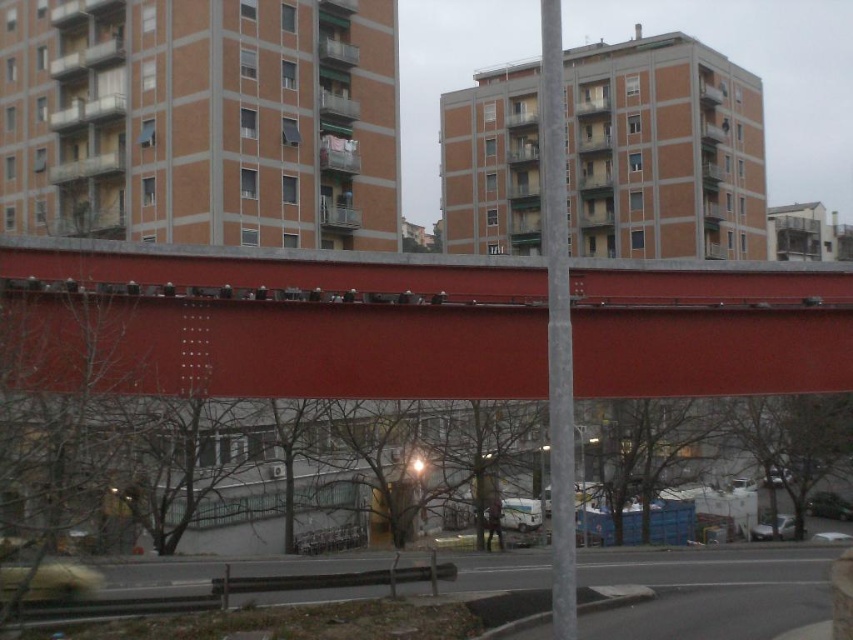
You are standing at the point with coordinates 0.5, 0.35 in the image. Is there a smooth red bridge at center near you?

Yes, the smooth red bridge at center is located at point [297,317], which is very close to your current position at [298,320].

You are standing at the point marked as point (556,323) in the image. What object is exactly at your current location?

The gray concrete pole at center is located at point (556,323).

You are a city planner assessing the space between the smooth red bridge at center and the gray concrete pole at center. If you want to install a new utility box that requires 2 meters of clearance, can the space accommodate it?

The smooth red bridge at center is thinner than the gray concrete pole at center, but the exact dimensions are not provided. Without knowing the actual width of either object, it is impossible to determine if the 2 meters of clearance is available.